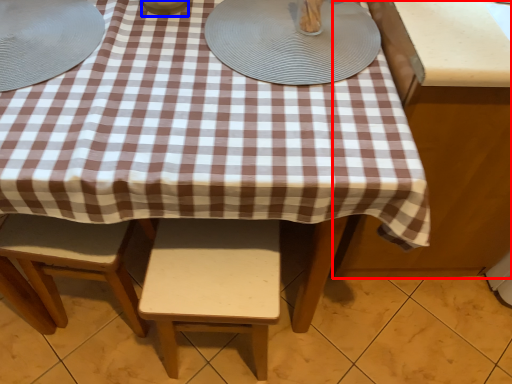
Question: Which of the following is the farthest to the observer, table (highlighted by a red box) or tableware (highlighted by a blue box)?

Choices:
 (A) table
 (B) tableware

Answer: (A)